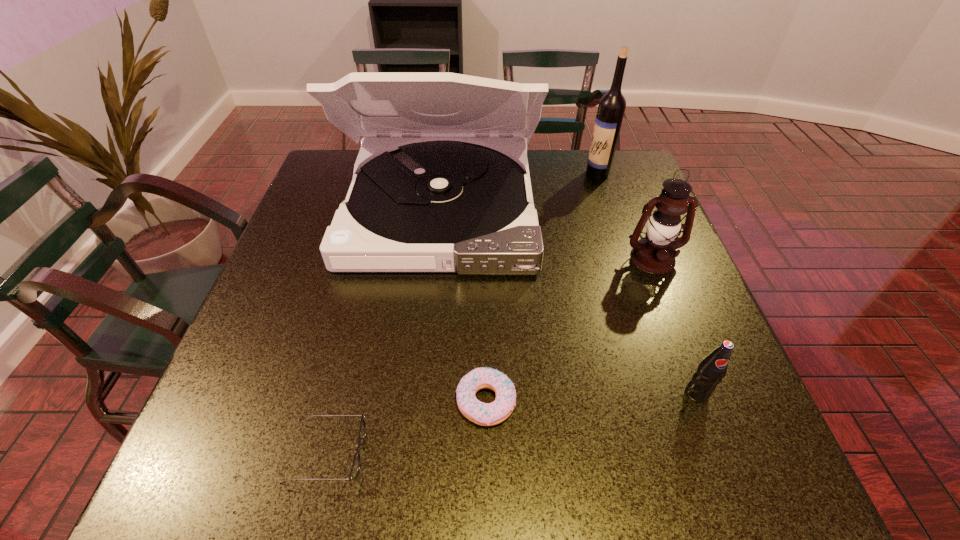
At what (x,y) coordinates should I click in order to perform the action: click on free space in the image that satisfies the following two spatial constraints: 1. on the side of the third tallest object, there is a wick adjustment knob; 2. through the lenses of the shortest object. Please return your answer as a coordinate pair (x, y). Looking at the image, I should click on (730, 454).

Where is `vacant point that satisfies the following two spatial constraints: 1. on the control panel of the CD player; 2. through the lenses of the shortest object`? vacant point that satisfies the following two spatial constraints: 1. on the control panel of the CD player; 2. through the lenses of the shortest object is located at coordinates point(415,454).

The height and width of the screenshot is (540, 960). Identify the location of free space that satisfies the following two spatial constraints: 1. on the front label of the pop; 2. through the lenses of the shortest object. (720, 454).

The width and height of the screenshot is (960, 540). In order to click on free spot that satisfies the following two spatial constraints: 1. on the control panel of the CD player; 2. through the lenses of the shortest object in this screenshot , I will do `click(415, 454)`.

Where is `vacant area that satisfies the following two spatial constraints: 1. on the control panel of the CD player; 2. through the lenses of the shortest object`? vacant area that satisfies the following two spatial constraints: 1. on the control panel of the CD player; 2. through the lenses of the shortest object is located at coordinates (415, 454).